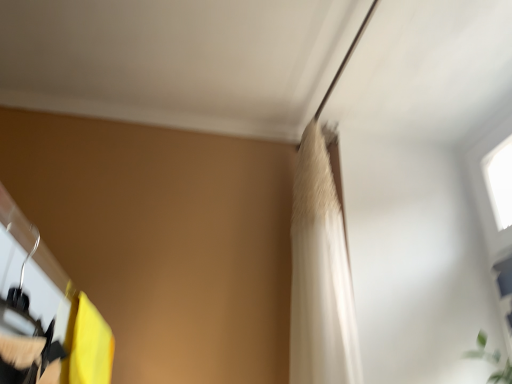
At what (x,y) coordinates should I click in order to perform the action: click on yellow fabric curtain at lower left. Please return your answer as a coordinate pair (x, y). The height and width of the screenshot is (384, 512). Looking at the image, I should click on (90, 346).

Image resolution: width=512 pixels, height=384 pixels. Describe the element at coordinates (320, 274) in the screenshot. I see `white fabric shower curtain at upper center` at that location.

Locate an element on the screen. This screenshot has width=512, height=384. yellow fabric curtain at lower left is located at coordinates (90, 346).

Can you confirm if white fabric shower curtain at upper center is positioned to the right of matte black hanger at left?

Indeed, white fabric shower curtain at upper center is positioned on the right side of matte black hanger at left.

Would you say white fabric shower curtain at upper center is inside or outside matte black hanger at left?

white fabric shower curtain at upper center is not enclosed by matte black hanger at left.

Between white fabric shower curtain at upper center and matte black hanger at left, which one has smaller size?

With smaller size is matte black hanger at left.

What's the angular difference between white fabric shower curtain at upper center and matte black hanger at left's facing directions?

The angle between the facing direction of white fabric shower curtain at upper center and the facing direction of matte black hanger at left is 86.8 degrees.

From the image's perspective, is matte black hanger at left below yellow fabric curtain at lower left?

No, from the image's perspective, matte black hanger at left is not beneath yellow fabric curtain at lower left.

Which object is positioned more to the left, matte black hanger at left or yellow fabric curtain at lower left?

From the viewer's perspective, yellow fabric curtain at lower left appears more on the left side.

Considering the sizes of objects matte black hanger at left and yellow fabric curtain at lower left in the image provided, who is bigger, matte black hanger at left or yellow fabric curtain at lower left?

With larger size is yellow fabric curtain at lower left.

Can you confirm if matte black hanger at left is shorter than yellow fabric curtain at lower left?

Yes, matte black hanger at left is shorter than yellow fabric curtain at lower left.

Does yellow fabric curtain at lower left lie behind white fabric shower curtain at upper center?

No, yellow fabric curtain at lower left is closer to the camera.

Is yellow fabric curtain at lower left positioned with its back to white fabric shower curtain at upper center?

No, yellow fabric curtain at lower left's orientation is not away from white fabric shower curtain at upper center.

How many degrees apart are the facing directions of yellow fabric curtain at lower left and white fabric shower curtain at upper center?

The angle between the facing direction of yellow fabric curtain at lower left and the facing direction of white fabric shower curtain at upper center is 86.8 degrees.

From the image's perspective, which one is positioned higher, yellow fabric curtain at lower left or white fabric shower curtain at upper center?

From the image's view, white fabric shower curtain at upper center is above.

Is yellow fabric curtain at lower left surrounded by white fabric shower curtain at upper center?

That's incorrect, yellow fabric curtain at lower left is not inside white fabric shower curtain at upper center.

In terms of width, does white fabric shower curtain at upper center look wider or thinner when compared to yellow fabric curtain at lower left?

Considering their sizes, white fabric shower curtain at upper center looks slimmer than yellow fabric curtain at lower left.

From a real-world perspective, is white fabric shower curtain at upper center located beneath yellow fabric curtain at lower left?

No.

Where is `shower curtain on the right of the yellow fabric curtain at lower left`? The height and width of the screenshot is (384, 512). shower curtain on the right of the yellow fabric curtain at lower left is located at coordinates pos(320,274).

Which of these two, matte black hanger at left or white fabric shower curtain at upper center, is thinner?

white fabric shower curtain at upper center.

In the image, is matte black hanger at left positioned in front of or behind white fabric shower curtain at upper center?

Clearly, matte black hanger at left is in front of white fabric shower curtain at upper center.

Is matte black hanger at left inside the boundaries of white fabric shower curtain at upper center, or outside?

The correct answer is: outside.

The width and height of the screenshot is (512, 384). What are the coordinates of `closet to the right of yellow fabric curtain at lower left` in the screenshot? It's located at (45, 313).

Would you say yellow fabric curtain at lower left is outside matte black hanger at left?

That's correct, yellow fabric curtain at lower left is outside of matte black hanger at left.

Which is behind, yellow fabric curtain at lower left or matte black hanger at left?

Positioned behind is yellow fabric curtain at lower left.

From a real-world perspective, is yellow fabric curtain at lower left under matte black hanger at left?

No, from a real-world perspective, yellow fabric curtain at lower left is not beneath matte black hanger at left.

This screenshot has height=384, width=512. I want to click on shower curtain on the right of matte black hanger at left, so click(x=320, y=274).

What are the coordinates of `curtain positioned vertically above the matte black hanger at left (from a real-world perspective)` in the screenshot? It's located at (90, 346).

Looking at the image, which one is located closer to yellow fabric curtain at lower left, white fabric shower curtain at upper center or matte black hanger at left?

The object closer to yellow fabric curtain at lower left is matte black hanger at left.

Based on their spatial positions, is yellow fabric curtain at lower left or matte black hanger at left further from white fabric shower curtain at upper center?

matte black hanger at left is further to white fabric shower curtain at upper center.

Based on their spatial positions, is yellow fabric curtain at lower left or white fabric shower curtain at upper center closer to matte black hanger at left?

Among the two, yellow fabric curtain at lower left is located nearer to matte black hanger at left.

Considering their positions, is matte black hanger at left positioned closer to white fabric shower curtain at upper center than yellow fabric curtain at lower left?

yellow fabric curtain at lower left.

Which object lies nearer to the anchor point matte black hanger at left, white fabric shower curtain at upper center or yellow fabric curtain at lower left?

Among the two, yellow fabric curtain at lower left is located nearer to matte black hanger at left.

From the image, which object appears to be nearer to yellow fabric curtain at lower left, matte black hanger at left or white fabric shower curtain at upper center?

Among the two, matte black hanger at left is located nearer to yellow fabric curtain at lower left.

Where is `curtain positioned between matte black hanger at left and white fabric shower curtain at upper center from near to far`? The width and height of the screenshot is (512, 384). curtain positioned between matte black hanger at left and white fabric shower curtain at upper center from near to far is located at coordinates (90, 346).